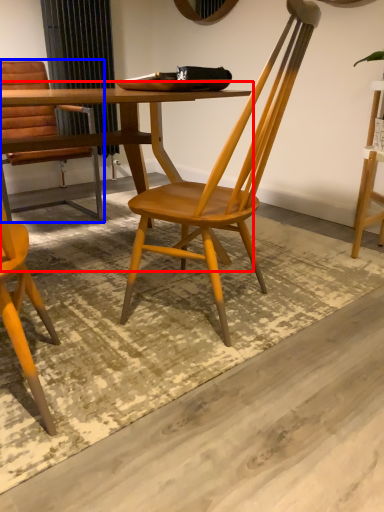
Question: Among these objects, which one is farthest to the camera, table (highlighted by a red box) or chair (highlighted by a blue box)?

Choices:
 (A) table
 (B) chair

Answer: (B)